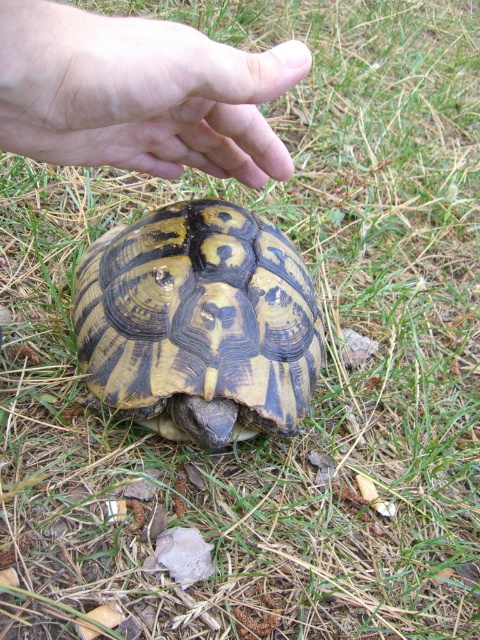
Question: Which of the following is the closest to the observer?

Choices:
 (A) patterned shell tortoise at center
 (B) smooth skin hand at upper center

Answer: (B)

Question: Among these objects, which one is nearest to the camera?

Choices:
 (A) smooth skin hand at upper center
 (B) patterned shell tortoise at center

Answer: (A)

Question: Can you confirm if patterned shell tortoise at center is bigger than smooth skin hand at upper center?

Choices:
 (A) yes
 (B) no

Answer: (A)

Question: Does patterned shell tortoise at center appear on the left side of smooth skin hand at upper center?

Choices:
 (A) yes
 (B) no

Answer: (A)

Question: Does patterned shell tortoise at center have a smaller size compared to smooth skin hand at upper center?

Choices:
 (A) no
 (B) yes

Answer: (A)

Question: Among these points, which one is nearest to the camera?

Choices:
 (A) (203, 376)
 (B) (112, 84)

Answer: (B)